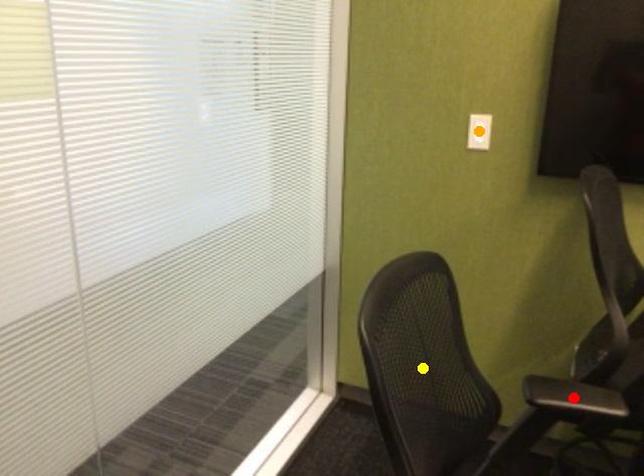
Order these from farthest to nearest:
orange point
red point
yellow point

1. orange point
2. red point
3. yellow point